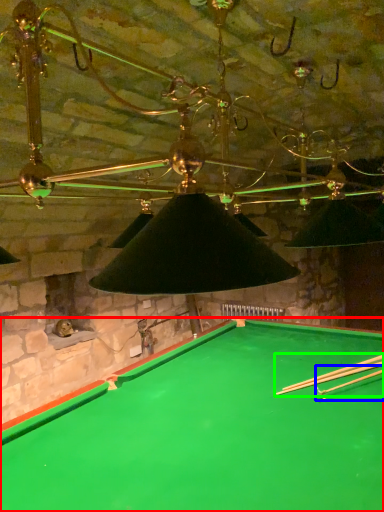
Question: Which is farther away from billiard table (highlighted by a red box)? cue (highlighted by a blue box) or cue (highlighted by a green box)?

Choices:
 (A) cue
 (B) cue

Answer: (A)